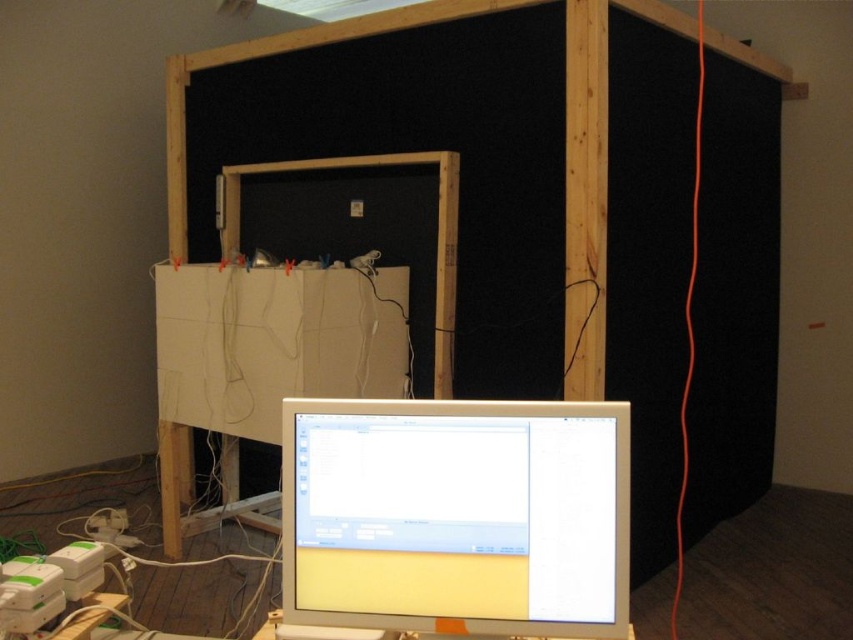
You are setting up a new monitor and need to know if it will fit in a space that can only accommodate items up to the thickness of the white cardboard at center. Based on the scene, will the white glossy monitor at center fit?

The white glossy monitor at center is thinner than the white cardboard at center, so it will fit in the space.

You are setting up a presentation and need to ensure that the white glossy monitor at center and the white cardboard at center are arranged properly. According to the scene, which object is placed above the other?

The white glossy monitor at center is positioned over the white cardboard at center, so the monitor is above the cardboard.